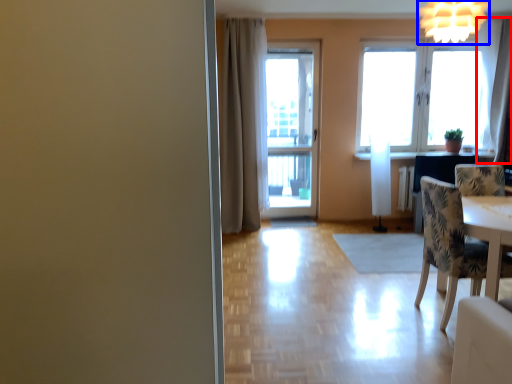
Question: Which object appears closest to the camera in this image, curtain (highlighted by a red box) or light fixture (highlighted by a blue box)?

Choices:
 (A) curtain
 (B) light fixture

Answer: (B)